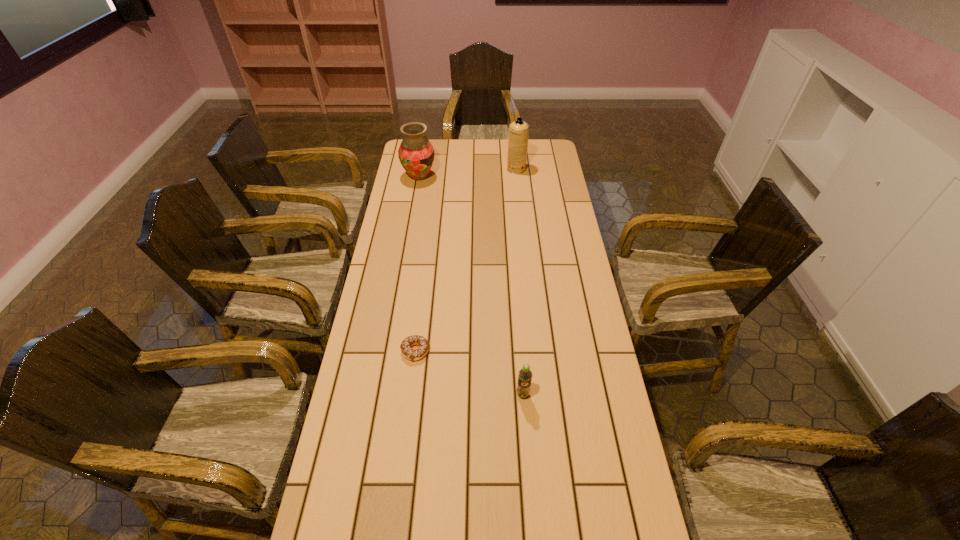
Identify the location of vacant region between the doughnut and the aerosol can. This screenshot has width=960, height=540. (466, 260).

Where is `free space between the shortest object and the vase`? free space between the shortest object and the vase is located at coordinates (418, 264).

Locate an element on the screen. Image resolution: width=960 pixels, height=540 pixels. vacant area that lies between the aerosol can and the vase is located at coordinates (468, 173).

What are the coordinates of `free point between the soda and the vase` in the screenshot? It's located at (471, 286).

This screenshot has height=540, width=960. I want to click on empty space that is in between the second nearest object and the soda, so click(x=469, y=373).

This screenshot has height=540, width=960. In order to click on empty space between the vase and the aerosol can in this screenshot , I will do `click(468, 173)`.

The height and width of the screenshot is (540, 960). I want to click on vacant point located between the second shortest object and the vase, so click(471, 286).

Identify the location of vacant space that's between the vase and the second shortest object. (471, 286).

I want to click on vacant space that is in between the nearest object and the aerosol can, so point(519,282).

Select which object appears as the third closest to the aerosol can. Please provide its 2D coordinates. Your answer should be formatted as a tuple, i.e. [(x, y)], where the tuple contains the x and y coordinates of a point satisfying the conditions above.

[(525, 375)]